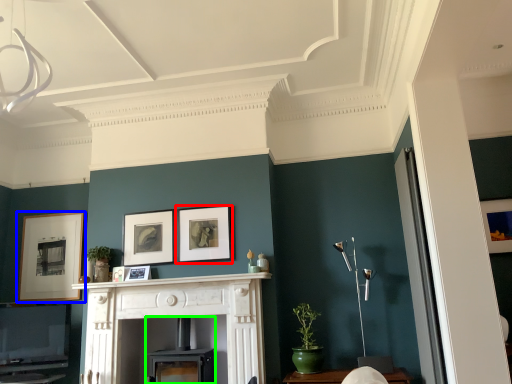
Question: Estimate the real-world distances between objects in this image. Which object is closer to picture frame (highlighted by a red box), picture frame (highlighted by a blue box) or fireplace (highlighted by a green box)?

Choices:
 (A) picture frame
 (B) fireplace

Answer: (B)